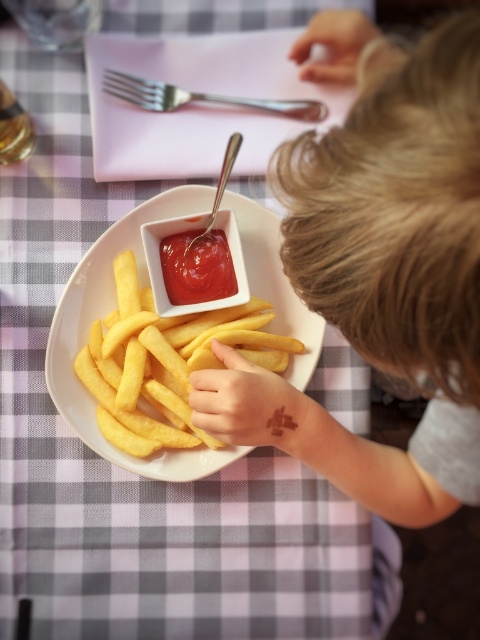
Which of these two, smooth yellow fries at center or satin silver fork at upper center, stands taller?

smooth yellow fries at center

Between smooth yellow fries at center and satin silver fork at upper center, which one is positioned lower?

smooth yellow fries at center

Does point (360, 468) lie in front of point (311, 108)?

Yes, point (360, 468) is closer to viewer.

The image size is (480, 640). Find the location of `smooth yellow fries at center`. smooth yellow fries at center is located at coordinates (380, 268).

This screenshot has height=640, width=480. I want to click on smooth yellow fries at center, so click(x=380, y=268).

Based on the photo, between smooth yellow fries at center and yellow crispy french fries at center, which one appears on the right side from the viewer's perspective?

smooth yellow fries at center

Locate an element on the screen. smooth yellow fries at center is located at coordinates (380, 268).

Between yellow crispy french fries at center and shiny red ketchup at center, which one is positioned higher?

shiny red ketchup at center is above.

Is point (260, 346) in front of point (220, 253)?

No, it is not.

What do you see at coordinates (166, 362) in the screenshot? This screenshot has height=640, width=480. I see `yellow crispy french fries at center` at bounding box center [166, 362].

Locate an element on the screen. This screenshot has height=640, width=480. yellow crispy french fries at center is located at coordinates (166, 362).